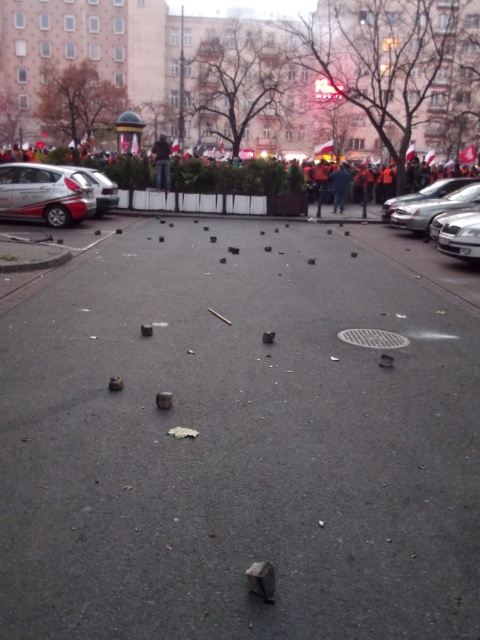
You are a pedestrian trying to cross the street from the left side to the right side. There are two cars in the way. Which car should you go around first, the metallic silver car at right or the silver metallic car at left?

You should go around the silver metallic car at left first since it is closer to your starting position on the left side of the street, and the metallic silver car at right is positioned further to the right.

You are a photographer standing on the sidewalk of this urban street scene. You notice two jackets in the center of the image. Which jacket would appear larger in your camera viewfinder, the dark gray jacket at center or the dark blue jacket at center?

The dark gray jacket at center would appear larger in the camera viewfinder because it is bigger than the dark blue jacket at center according to the description.